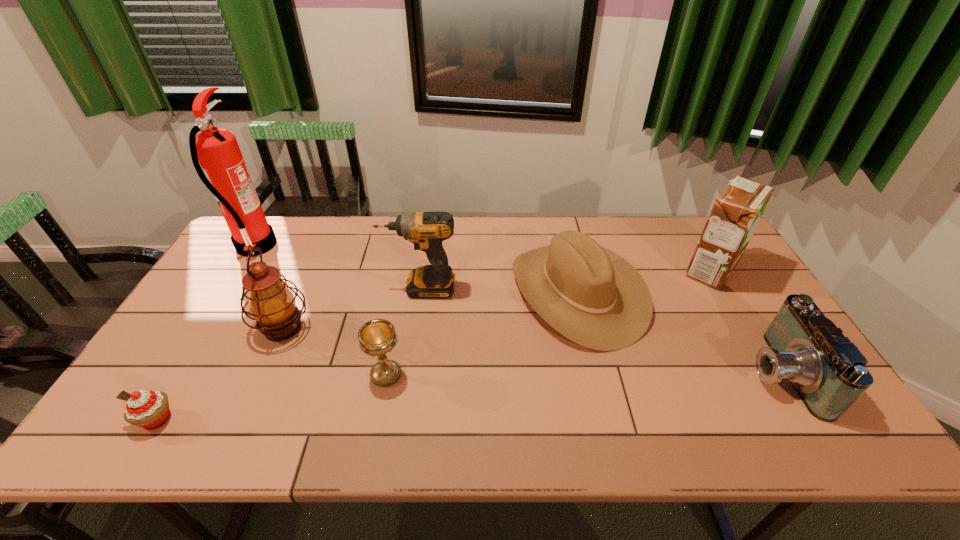
At what (x,y) coordinates should I click in order to perform the action: click on vacant space located 0.050m on the back of the chalice. Please return your answer as a coordinate pair (x, y). The height and width of the screenshot is (540, 960). Looking at the image, I should click on (392, 345).

Identify the location of free space located 0.370m on the back of the shortest object. Image resolution: width=960 pixels, height=540 pixels. (231, 294).

I want to click on fire extinguisher located at the far edge, so click(x=224, y=172).

Where is `carton present at the far edge`? carton present at the far edge is located at coordinates click(737, 210).

Where is `cowboy hat at the far edge`? cowboy hat at the far edge is located at coordinates (591, 295).

The height and width of the screenshot is (540, 960). Identify the location of camcorder that is positioned at the near edge. (828, 372).

Locate an element on the screen. The width and height of the screenshot is (960, 540). cupcake located in the near edge section of the desktop is located at coordinates (148, 409).

You are a GUI agent. You are given a task and a screenshot of the screen. Output one action in this format:
    pyautogui.click(x=<x>, y=<y>)
    Task: Click on the fire extinguisher that is at the left edge
    This screenshot has width=960, height=540.
    Given the screenshot: What is the action you would take?
    pyautogui.click(x=224, y=172)

The image size is (960, 540). I want to click on cupcake present at the left edge, so click(148, 409).

Identify the location of carton located at the right edge. (737, 210).